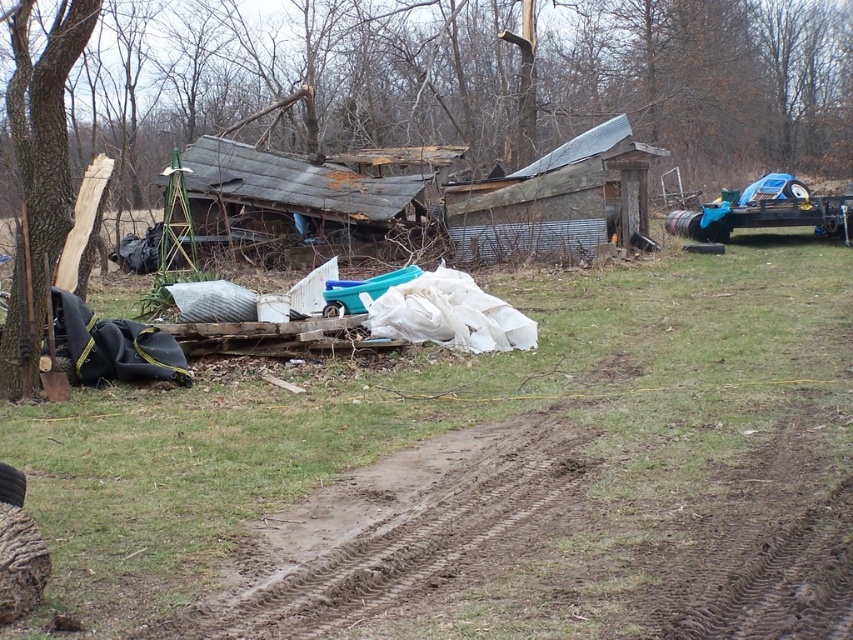
Does rusty corrugated metal hut at center have a smaller size compared to rusty corrugated tin hut at center?

No, rusty corrugated metal hut at center is not smaller than rusty corrugated tin hut at center.

Image resolution: width=853 pixels, height=640 pixels. What do you see at coordinates (294, 200) in the screenshot?
I see `rusty corrugated metal hut at center` at bounding box center [294, 200].

Where is `rusty corrugated metal hut at center`? This screenshot has width=853, height=640. rusty corrugated metal hut at center is located at coordinates (294, 200).

Is rusty corrugated metal hut at center wider than brown rough wood at left?

Yes.

Can you confirm if rusty corrugated metal hut at center is positioned above brown rough wood at left?

Correct, rusty corrugated metal hut at center is located above brown rough wood at left.

Who is more forward, (322, 188) or (0, 356)?

Point (0, 356)

What are the coordinates of `rusty corrugated metal hut at center` in the screenshot? It's located at (294, 200).

Is brown wood tree at left to the right of rusty corrugated metal hut at center from the viewer's perspective?

Yes, brown wood tree at left is to the right of rusty corrugated metal hut at center.

Is brown wood tree at left to the left of rusty corrugated metal hut at center from the viewer's perspective?

No, brown wood tree at left is not to the left of rusty corrugated metal hut at center.

Which is behind, point (447, 118) or point (242, 150)?

The point (447, 118) is more distant.

Where is `brown wood tree at left`? This screenshot has width=853, height=640. brown wood tree at left is located at coordinates (547, 125).